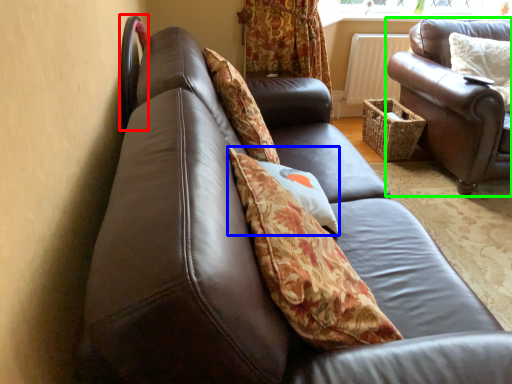
Question: Which object is the closest to the chair (highlighted by a red box)? Choose among these: pillow (highlighted by a blue box) or studio couch (highlighted by a green box).

Choices:
 (A) pillow
 (B) studio couch

Answer: (A)